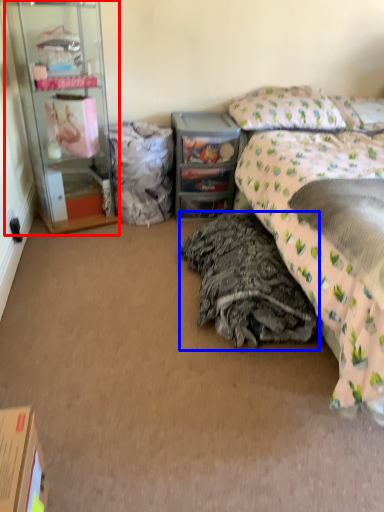
Question: Which of the following is the closest to the observer, cabinetry (highlighted by a red box) or material (highlighted by a blue box)?

Choices:
 (A) cabinetry
 (B) material

Answer: (B)